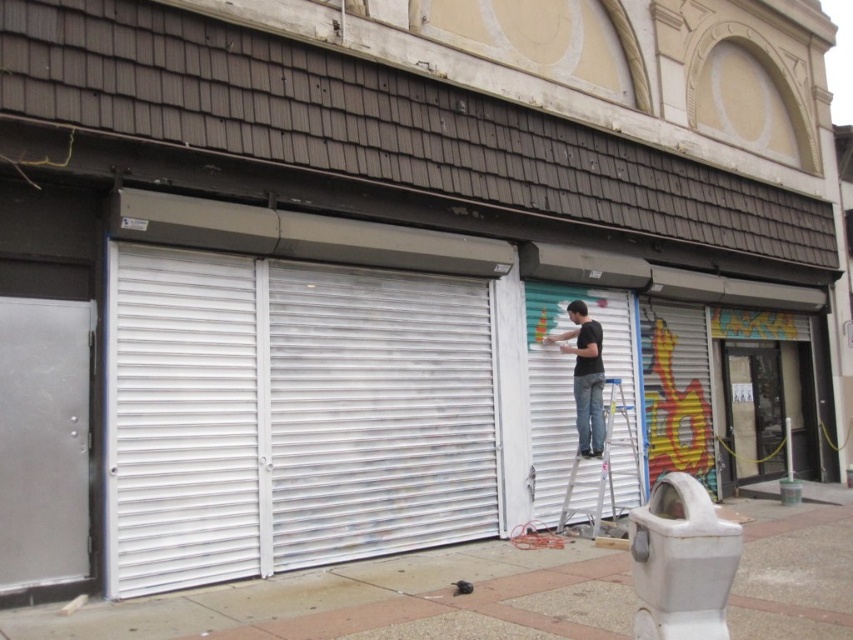
You are a painter who wants to paint a large mural on the white corrugated metal at left and the multicolored painted metal shutter at right. Which surface is closer to the street if the street is in front of the building?

The white corrugated metal at left is closer to the street because it is positioned to the left of the multicolored painted metal shutter at right, and since the street is in front of the building, the left side would be closer.

You are standing in front of the building and see two points on the security shutters. The first point is at coordinates point (740, 355) and the second is at point (633, 449). Which point is closer to you?

Point (633, 449) is closer to you because it is closer to the camera than point (740, 355).

You are a delivery person trying to deliver a package to the transparent glass door at center. The white corrugated metal at left is blocking your path. Can you move around it to reach the door?

The white corrugated metal at left might be wider than transparent glass door at center, so it is possible that the metal obstruction is wider than the door, making it difficult to navigate around it. However, without exact measurements, it is uncertain whether there is enough space to maneuver around the white corrugated metal at left to reach the transparent glass door at center.